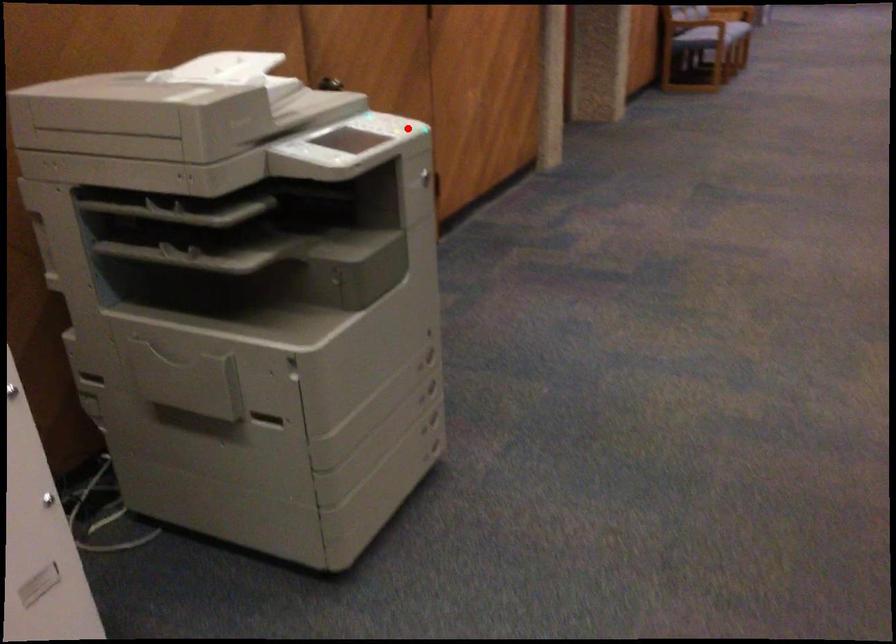
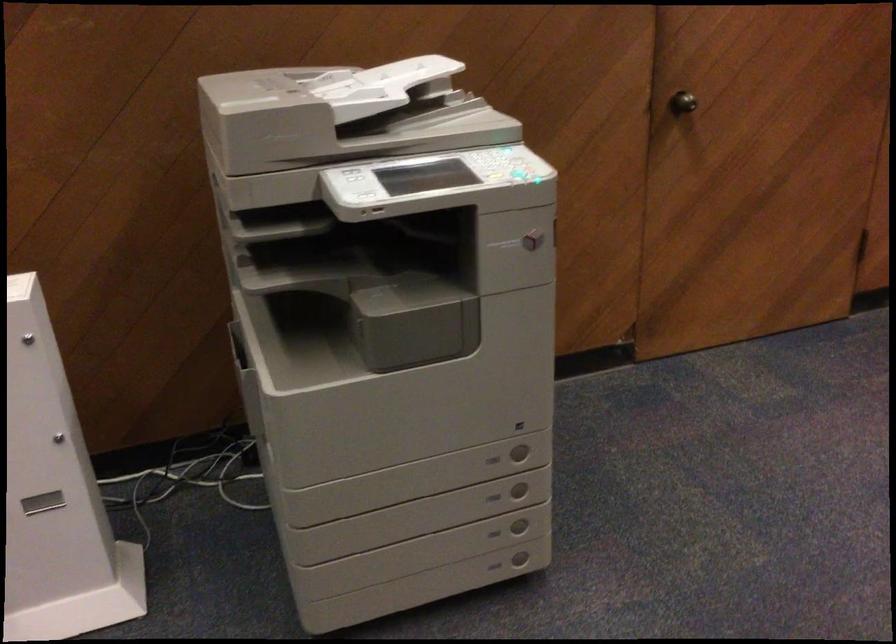
Find the pixel in the second image that matches the highlighted location in the first image.

(521, 176)